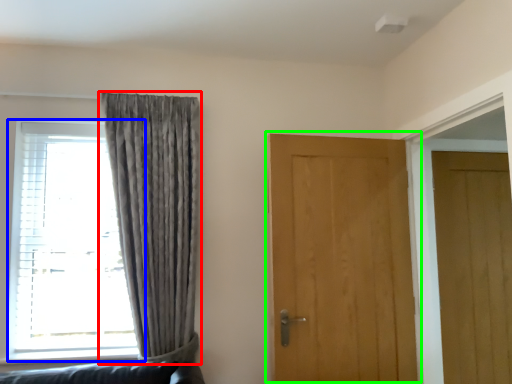
Question: Estimate the real-world distances between objects in this image. Which object is closer to curtain (highlighted by a red box), window (highlighted by a blue box) or door (highlighted by a green box)?

Choices:
 (A) window
 (B) door

Answer: (A)